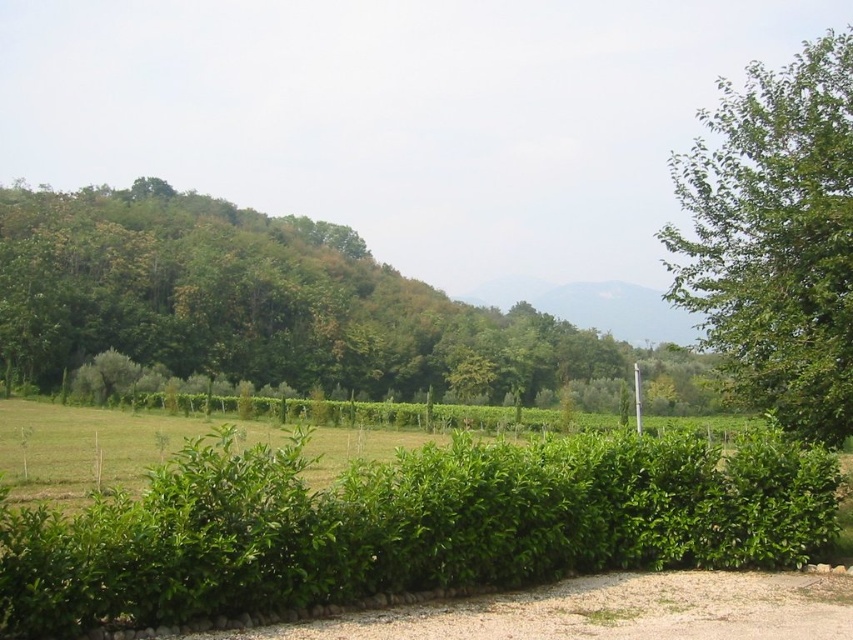
You are a gardener planning to plant a new tree in this rural landscape. You notice the green leafy tree at upper left and the green leafy tree at right. Which tree is taller?

The green leafy tree at right is taller than the green leafy tree at upper left.

You are standing on the gravel path and want to walk to the tree. Which direction should you move relative to the green leafy hedge at center to reach the green leafy tree at upper left?

To reach the green leafy tree at upper left from the gravel path, you should move towards the upper left direction relative to the green leafy hedge at center since the tree is positioned above the hedge.